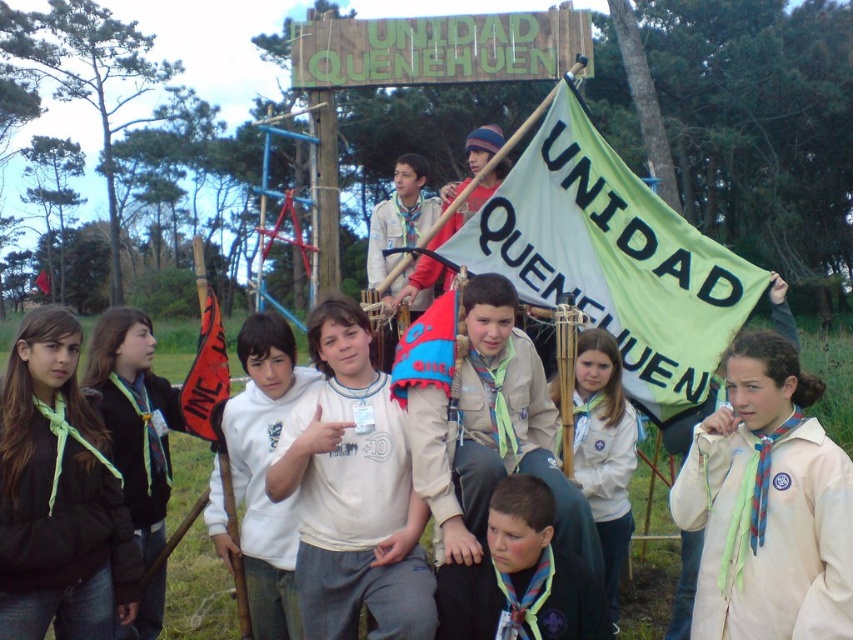
Question: Is green fabric scarf at left thinner than white fabric scarf at center?

Choices:
 (A) yes
 (B) no

Answer: (A)

Question: Which point is closer to the camera taking this photo?

Choices:
 (A) (552, 538)
 (B) (183, 404)
 (C) (519, 296)
 (D) (41, 276)

Answer: (A)

Question: Which point appears closest to the camera in this image?

Choices:
 (A) (103, 456)
 (B) (700, 310)
 (C) (190, 397)
 (D) (253, 476)

Answer: (A)

Question: Is white cotton hoodie at center to the left of light brown uniform at center from the viewer's perspective?

Choices:
 (A) no
 (B) yes

Answer: (B)

Question: Which point is farther from the camera taking this photo?

Choices:
 (A) pos(300,384)
 (B) pos(396,440)

Answer: (A)

Question: Is white matte jacket at center further to the viewer compared to white matte shirt at center?

Choices:
 (A) yes
 (B) no

Answer: (B)